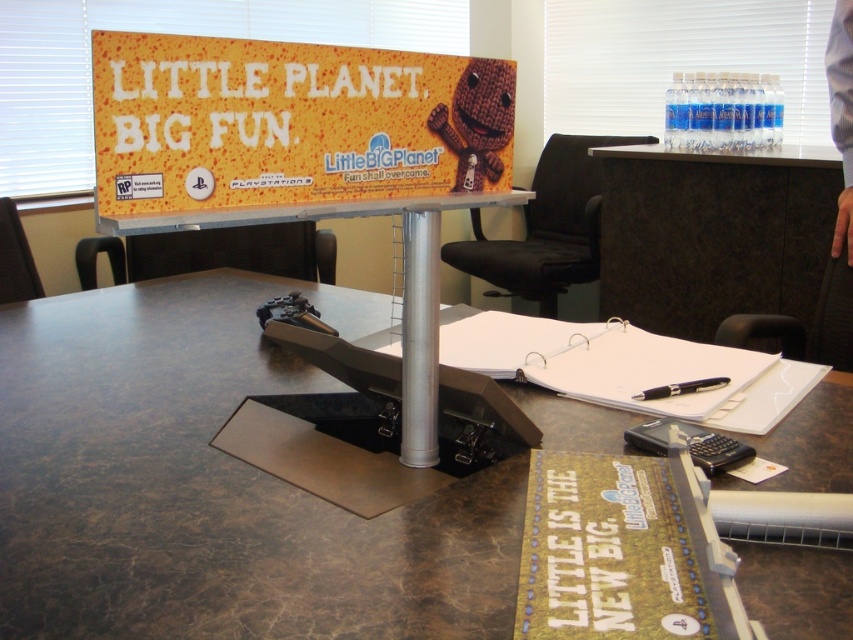
You are standing in the office and want to place a new poster on the wall directly above the brown marble table at center. If the wall is marked with a grid system where each grid square is 1 unit, and the table is at coordinates point 0.759, 0.250, what are the coordinates where you should place the poster to center it above the table?

To center the poster above the brown marble table at center, you should place it at the same x coordinate as the table, which is 0.759, and adjust the y coordinate to be higher, such as 0.250 plus the desired vertical distance. The exact coordinates depend on the poster size and desired placement, but maintaining the x coordinate ensures alignment.

You are setting up a promotional display for the game LittleBigPlanet. The brown marble table at center is where the sign will be placed. Can you confirm the exact coordinates of the table to ensure proper alignment with the venue layout?

The brown marble table at center is located at point (212, 484), so you can use these coordinates to align the sign properly.